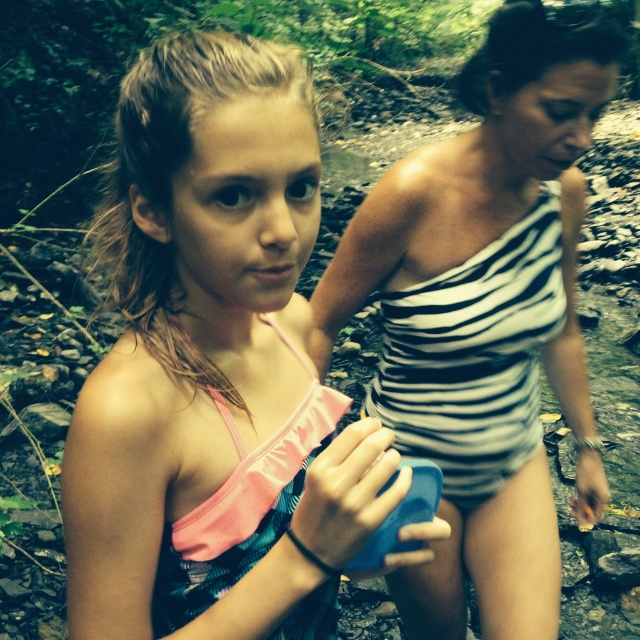
You are a photographer trying to capture a clear shot of both the pink fabric swimsuit at center and the striped fabric swimsuit at center. Since you want both subjects in focus, which one should you adjust your camera focus to prioritize first?

You should prioritize focusing on the pink fabric swimsuit at center first because it is closer to the viewer than the striped fabric swimsuit at center. This way, adjusting focus for the closer object ensures both will be in focus when using proper depth of field.

You are a photographer trying to capture a group photo of the two people in the image. Since you want to ensure both the pink fabric swimsuit at center and the striped fabric swimsuit at center are clearly visible, which swimsuit should you focus on first to ensure proper exposure, and why?

The pink fabric swimsuit at center has a smaller size compared to striped fabric swimsuit at center, so you should focus on the pink fabric swimsuit at center first because it is smaller and might require more precise adjustment to ensure details are captured clearly.

You are a drone operator trying to capture a photo of the young girl holding the small blue object and the adult woman behind her. The drone is currently positioned at point (250,634). To ensure both subjects are in frame, what is the minimum distance the drone needs to move away from its current position to accommodate the 23.81 inches between them?

The minimum distance the drone needs to move away from point (250,634) is determined by the 23.81 inches between the young girl and the adult woman. To fit both into the frame, the drone should position itself at least 23.81 inches away from the closer subject to ensure both are visible.